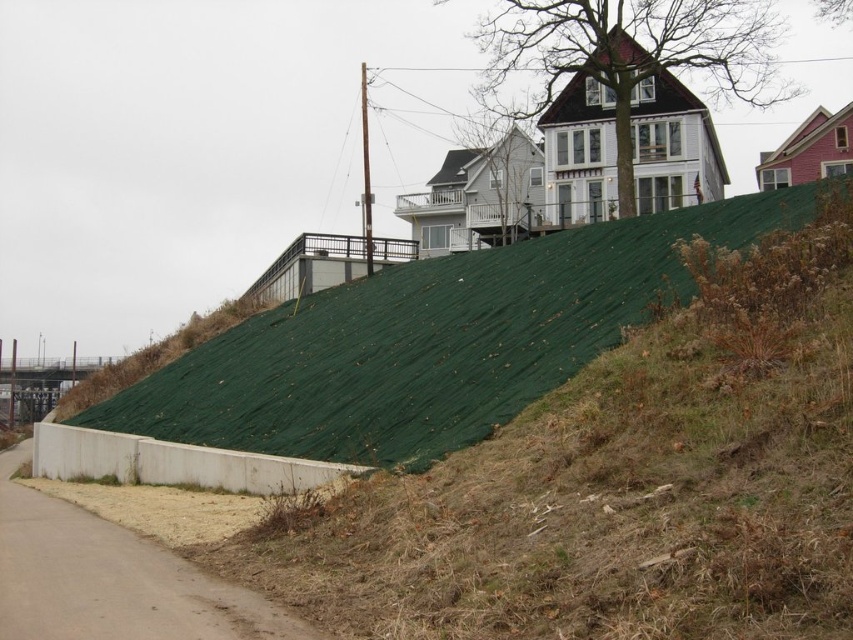
Question: Among these points, which one is nearest to the camera?

Choices:
 (A) (811, 412)
 (B) (653, 108)

Answer: (A)

Question: Observing the image, what is the correct spatial positioning of green fabric at upper center in reference to brown shingles at upper center?

Choices:
 (A) above
 (B) below

Answer: (B)

Question: Which of the following is the closest to the observer?

Choices:
 (A) (634, 579)
 (B) (670, 108)

Answer: (A)

Question: Which of the following is the closest to the observer?

Choices:
 (A) green fabric at upper center
 (B) brown shingles at upper center

Answer: (A)

Question: Is the position of green fabric at upper center less distant than that of brown shingles at upper center?

Choices:
 (A) no
 (B) yes

Answer: (B)

Question: Does green fabric at upper center appear on the right side of brown shingles at upper center?

Choices:
 (A) yes
 (B) no

Answer: (B)